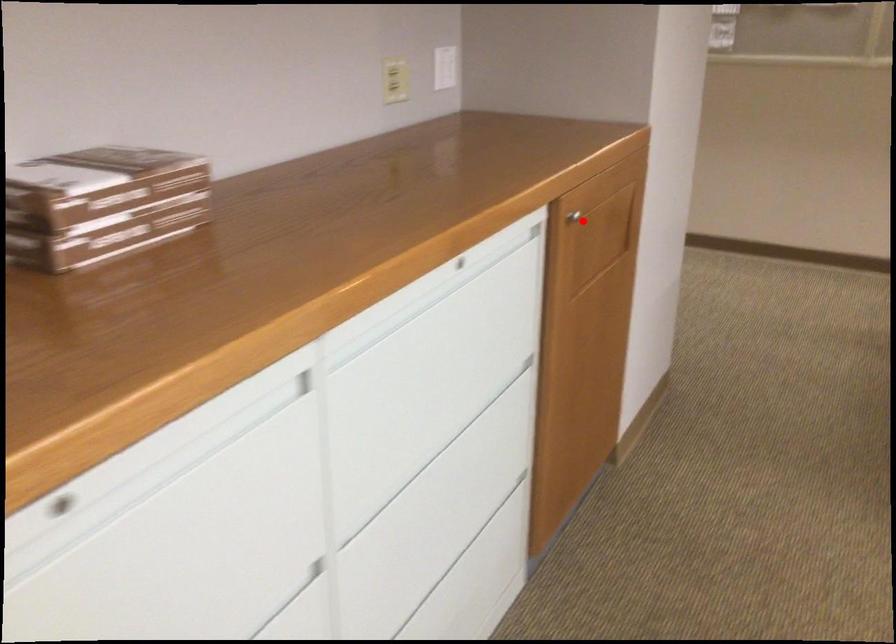
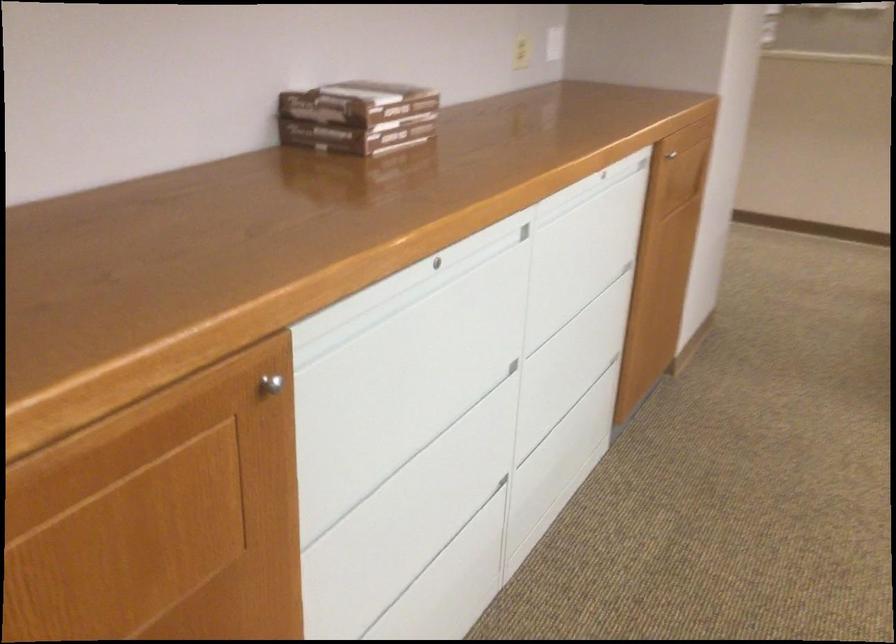
Question: I am providing you with two images of the same scene from different viewpoints. Image1 has a red point marked. In image2, the corresponding 3D location appears at what relative position? Reply with the corresponding letter.

Choices:
 (A) Closer
 (B) Farther

Answer: (B)